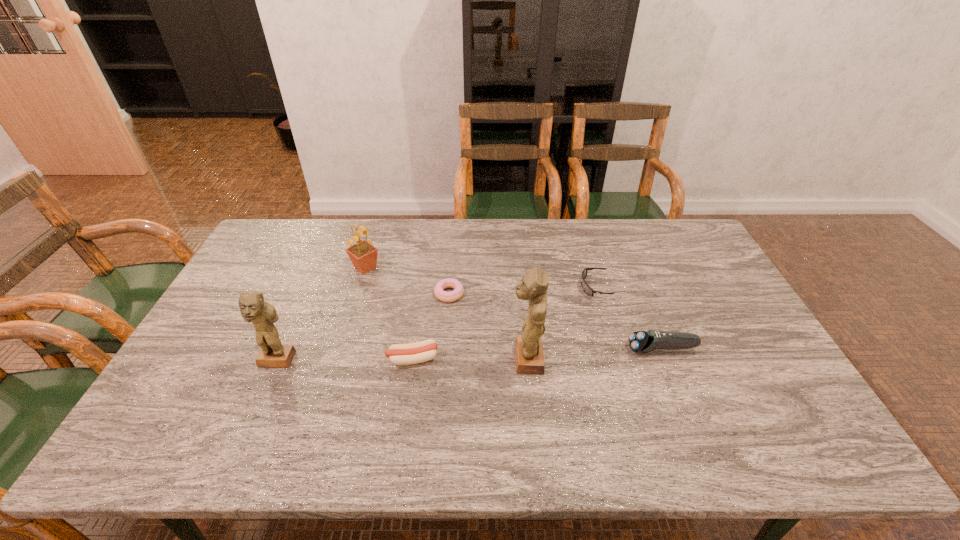
Locate an element on the screen. The width and height of the screenshot is (960, 540). object that is the fourth closest to the fourth shortest object is located at coordinates (399, 354).

Identify the location of free space that satisfies the following two spatial constraints: 1. at the front of the second object from left to right with flowers visible; 2. on the front-facing side of the leftmost object. (337, 361).

What are the coordinates of `vacant region that satisfies the following two spatial constraints: 1. at the front of the sixth object from right to left with flowers visible; 2. on the back side of the shortest object` in the screenshot? It's located at (357, 294).